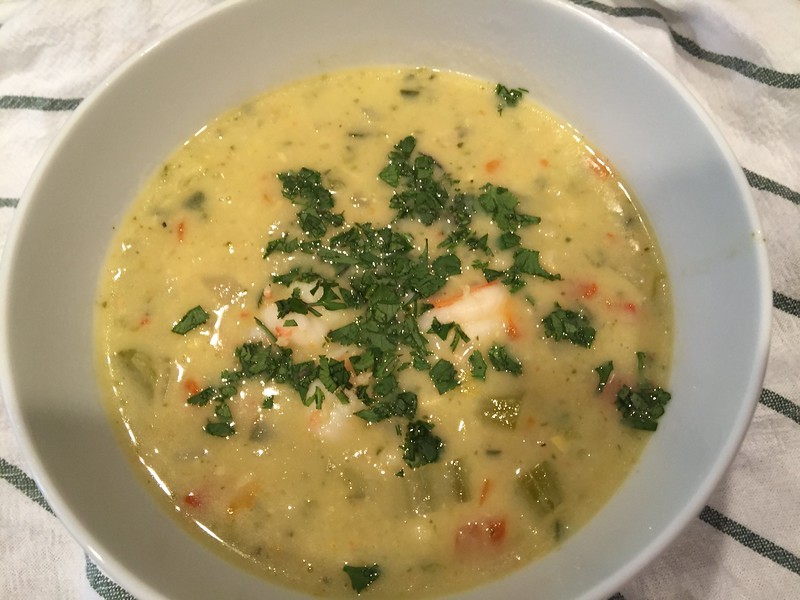
You are a GUI agent. You are given a task and a screenshot of the screen. Output one action in this format:
    pyautogui.click(x=<x>, y=<y>)
    Task: Click on the 1 white bowl
    The width and height of the screenshot is (800, 600).
    Given the screenshot: What is the action you would take?
    pyautogui.click(x=53, y=225)